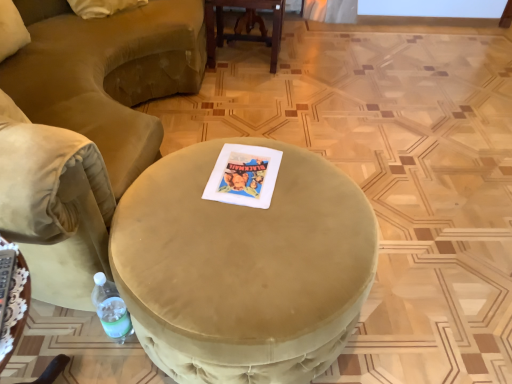
Find the location of a particular element. This screenshot has height=384, width=512. vacant position to the left of translucent plastic bottle at lower left is located at coordinates (71, 341).